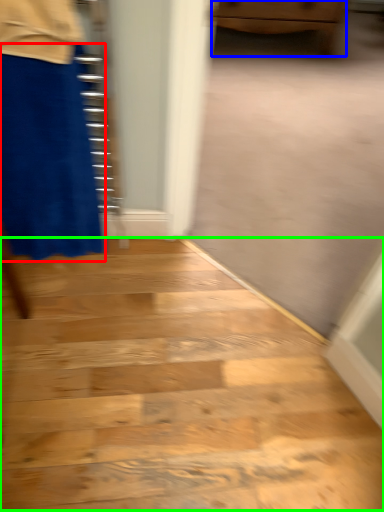
Question: Based on their relative distances, which object is nearer to miniskirt (highlighted by a red box)? Choose from furniture (highlighted by a blue box) and stairwell (highlighted by a green box).

Choices:
 (A) furniture
 (B) stairwell

Answer: (B)